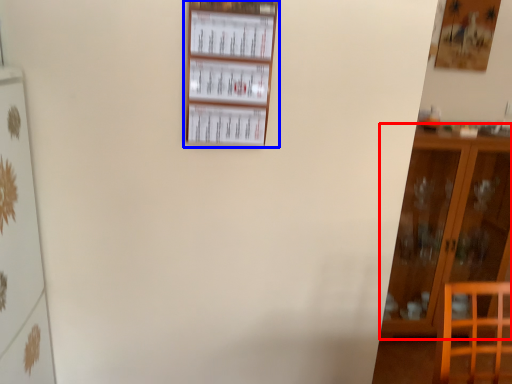
Question: Which point is closer to the camera, furniture (highlighted by a red box) or shelf (highlighted by a blue box)?

Choices:
 (A) furniture
 (B) shelf

Answer: (B)